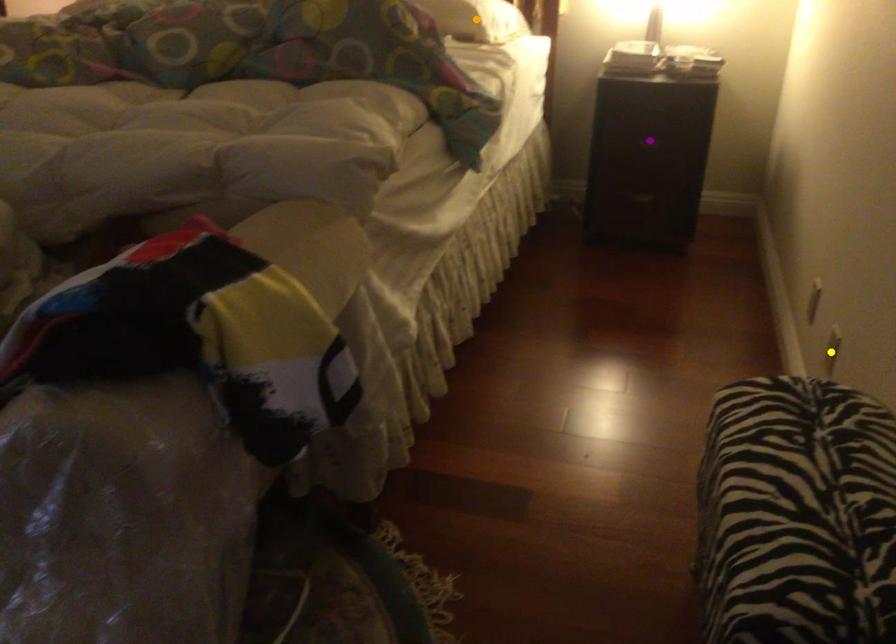
Order these from nearest to farthest:
A) orange point
B) purple point
C) yellow point

orange point < purple point < yellow point